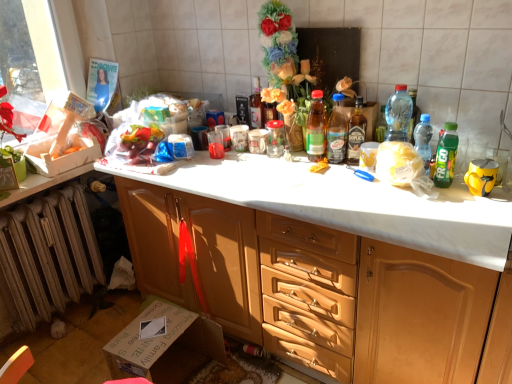
Find the location of `vacant space positioned to the left of translucent plastic bottle at center, acting as the second bottle starting from the left`. vacant space positioned to the left of translucent plastic bottle at center, acting as the second bottle starting from the left is located at coordinates (283, 160).